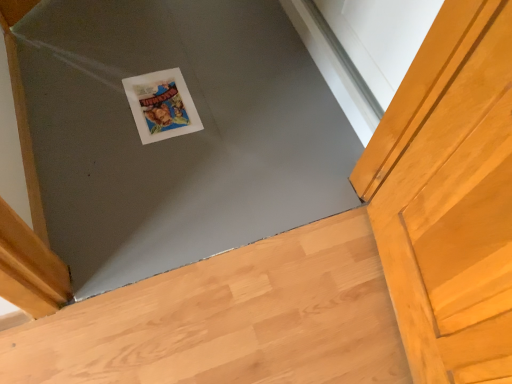
What is the approximate width of natural wood plywood at center?

natural wood plywood at center is 20.89 inches in width.

The image size is (512, 384). I want to click on natural wood plywood at center, so click(x=230, y=320).

This screenshot has height=384, width=512. What do you see at coordinates (230, 320) in the screenshot?
I see `natural wood plywood at center` at bounding box center [230, 320].

Where is `natural wood plywood at center`? The height and width of the screenshot is (384, 512). natural wood plywood at center is located at coordinates (230, 320).